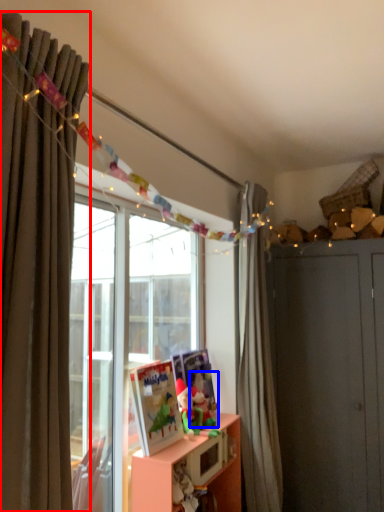
Question: Which object is further to the camera taking this photo, curtain (highlighted by a red box) or toy (highlighted by a blue box)?

Choices:
 (A) curtain
 (B) toy

Answer: (B)